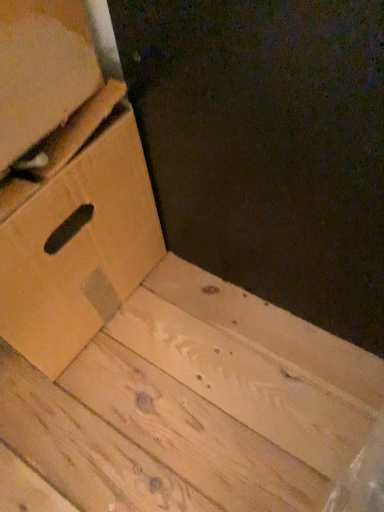
What do you see at coordinates (42, 70) in the screenshot? Image resolution: width=384 pixels, height=512 pixels. I see `matte cardboard box at left` at bounding box center [42, 70].

Locate an element on the screen. The image size is (384, 512). matte cardboard box at left is located at coordinates (42, 70).

You are a GUI agent. You are given a task and a screenshot of the screen. Output one action in this format:
    pyautogui.click(x=<x>, y=<y>)
    Task: Click on the brown cardboard drawer at lower left
    Image resolution: width=384 pixels, height=512 pixels.
    Given the screenshot: What is the action you would take?
    pyautogui.click(x=79, y=248)

This screenshot has width=384, height=512. What do you see at coordinates (79, 248) in the screenshot?
I see `brown cardboard drawer at lower left` at bounding box center [79, 248].

Locate an element on the screen. matte cardboard box at left is located at coordinates (42, 70).

Considering the relative positions of brown cardboard drawer at lower left and matte cardboard box at left in the image provided, is brown cardboard drawer at lower left to the right of matte cardboard box at left from the viewer's perspective?

Incorrect, brown cardboard drawer at lower left is not on the right side of matte cardboard box at left.

In the image, is brown cardboard drawer at lower left positioned in front of or behind matte cardboard box at left?

brown cardboard drawer at lower left is positioned farther from the viewer than matte cardboard box at left.

Does point (42, 223) come behind point (27, 86)?

Yes, point (42, 223) is behind point (27, 86).

From the image's perspective, which is above, brown cardboard drawer at lower left or matte cardboard box at left?

matte cardboard box at left is shown above in the image.

From a real-world perspective, is brown cardboard drawer at lower left positioned under matte cardboard box at left based on gravity?

Indeed, from a real-world perspective, brown cardboard drawer at lower left is positioned beneath matte cardboard box at left.

In terms of width, does brown cardboard drawer at lower left look wider or thinner when compared to matte cardboard box at left?

Clearly, brown cardboard drawer at lower left has more width compared to matte cardboard box at left.

Between brown cardboard drawer at lower left and matte cardboard box at left, which one has more height?

brown cardboard drawer at lower left is taller.

Does brown cardboard drawer at lower left have a smaller size compared to matte cardboard box at left?

Incorrect, brown cardboard drawer at lower left is not smaller in size than matte cardboard box at left.

Do you think brown cardboard drawer at lower left is within matte cardboard box at left, or outside of it?

brown cardboard drawer at lower left is spatially situated outside matte cardboard box at left.

Is brown cardboard drawer at lower left with matte cardboard box at left?

brown cardboard drawer at lower left and matte cardboard box at left are clearly separated.

Could you tell me if brown cardboard drawer at lower left is turned towards matte cardboard box at left?

No, brown cardboard drawer at lower left is not turned towards matte cardboard box at left.

How many degrees apart are the facing directions of brown cardboard drawer at lower left and matte cardboard box at left?

The angle between the facing direction of brown cardboard drawer at lower left and the facing direction of matte cardboard box at left is 7.45 degrees.

Identify the location of cardboard box above the brown cardboard drawer at lower left (from the image's perspective). This screenshot has width=384, height=512. (42, 70).

Is matte cardboard box at left to the right of brown cardboard drawer at lower left from the viewer's perspective?

Indeed, matte cardboard box at left is positioned on the right side of brown cardboard drawer at lower left.

In the image, is matte cardboard box at left positioned in front of or behind brown cardboard drawer at lower left?

Clearly, matte cardboard box at left is in front of brown cardboard drawer at lower left.

Is point (54, 4) closer or farther from the camera than point (65, 207)?

Clearly, point (54, 4) is closer to the camera than point (65, 207).

From the image's perspective, relative to brown cardboard drawer at lower left, is matte cardboard box at left above or below?

From the image's perspective, matte cardboard box at left appears above brown cardboard drawer at lower left.

From a real-world perspective, between matte cardboard box at left and brown cardboard drawer at lower left, who is vertically higher?

From a 3D spatial view, matte cardboard box at left is above.

Between matte cardboard box at left and brown cardboard drawer at lower left, which one has smaller width?

matte cardboard box at left is thinner.

In the scene shown: Considering the sizes of objects matte cardboard box at left and brown cardboard drawer at lower left in the image provided, who is shorter, matte cardboard box at left or brown cardboard drawer at lower left?

matte cardboard box at left.

Is matte cardboard box at left smaller than brown cardboard drawer at lower left?

Indeed, matte cardboard box at left has a smaller size compared to brown cardboard drawer at lower left.

Is matte cardboard box at left completely or partially outside of brown cardboard drawer at lower left?

Yes.

Is matte cardboard box at left positioned far away from brown cardboard drawer at lower left?

matte cardboard box at left is actually quite close to brown cardboard drawer at lower left.

Is matte cardboard box at left oriented towards brown cardboard drawer at lower left?

No, matte cardboard box at left is not oriented towards brown cardboard drawer at lower left.

Can you tell me how much matte cardboard box at left and brown cardboard drawer at lower left differ in facing direction?

The angular difference between matte cardboard box at left and brown cardboard drawer at lower left is 7.45 degrees.

Find the location of a particular element. cardboard box located above the brown cardboard drawer at lower left (from a real-world perspective) is located at coordinates (42, 70).

Locate an element on the screen. This screenshot has width=384, height=512. drawer lying on the left of matte cardboard box at left is located at coordinates (79, 248).

You are a GUI agent. You are given a task and a screenshot of the screen. Output one action in this format:
    pyautogui.click(x=<x>, y=<y>)
    Task: Click on the cardboard box above the brown cardboard drawer at lower left (from a real-world perspective)
    
    Given the screenshot: What is the action you would take?
    pyautogui.click(x=42, y=70)